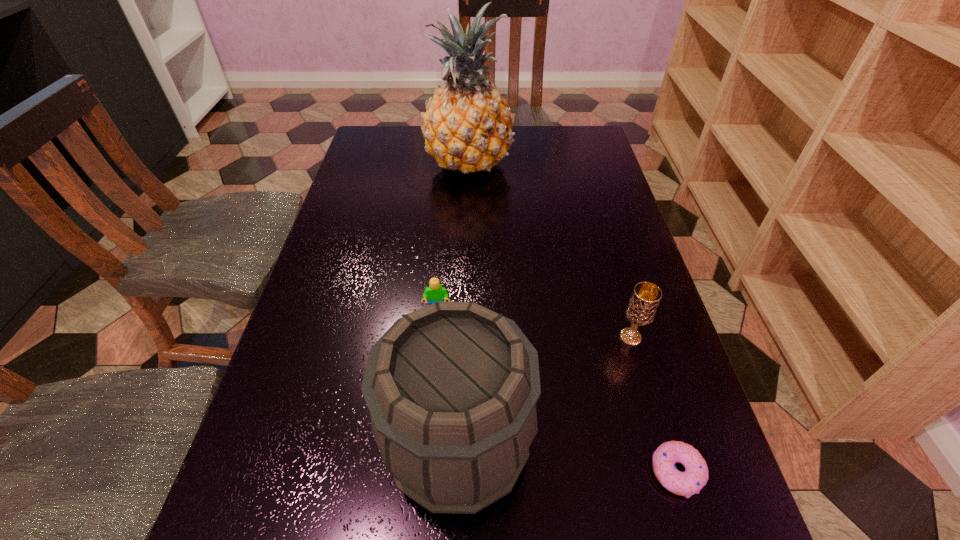
Find the location of a particular element. The height and width of the screenshot is (540, 960). vacant space at the far right corner is located at coordinates (599, 164).

Where is `vacant region between the doughnut and the chalice`? Image resolution: width=960 pixels, height=540 pixels. vacant region between the doughnut and the chalice is located at coordinates (654, 404).

At what (x,y) coordinates should I click in order to perform the action: click on empty location between the second tallest object and the third shortest object. Please return your answer as a coordinate pair (x, y). Looking at the image, I should click on (544, 392).

Locate an element on the screen. Image resolution: width=960 pixels, height=540 pixels. empty space that is in between the chalice and the fourth shortest object is located at coordinates (544, 392).

Image resolution: width=960 pixels, height=540 pixels. I want to click on free space between the wine bucket and the shortest object, so click(x=567, y=460).

Find the location of a particular element. The image size is (960, 540). free space that is in between the Lego and the farthest object is located at coordinates (453, 237).

Find the location of a particular element. vacant point located between the doughnut and the pineapple is located at coordinates (573, 318).

Find the location of `vacant space in between the farthest object and the fourth tallest object`. vacant space in between the farthest object and the fourth tallest object is located at coordinates (453, 237).

Identify which object is located as the nearest to the wine bucket. Please provide its 2D coordinates. Your answer should be formatted as a tuple, i.e. [(x, y)], where the tuple contains the x and y coordinates of a point satisfying the conditions above.

[(435, 292)]

Point out which object is positioned as the nearest to the chalice. Please provide its 2D coordinates. Your answer should be formatted as a tuple, i.e. [(x, y)], where the tuple contains the x and y coordinates of a point satisfying the conditions above.

[(690, 482)]